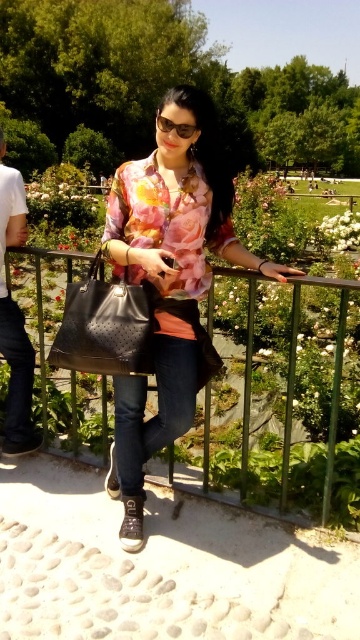
Question: Which of the following is the closest to the observer?

Choices:
 (A) (201, 195)
 (B) (65, 262)
 (C) (16, 188)

Answer: (A)

Question: Is green metal fence at center to the right of white cotton shirt at left from the viewer's perspective?

Choices:
 (A) no
 (B) yes

Answer: (B)

Question: Which of the following is the closest to the observer?

Choices:
 (A) green metal fence at center
 (B) white cotton shirt at left
 (C) floral-patterned shirt at center

Answer: (A)

Question: Which point is closer to the camera?

Choices:
 (A) (9, 321)
 (B) (182, 372)

Answer: (B)

Question: Does floral-patterned shirt at center have a smaller size compared to green metal fence at center?

Choices:
 (A) yes
 (B) no

Answer: (A)

Question: Does green metal fence at center appear on the left side of white cotton shirt at left?

Choices:
 (A) yes
 (B) no

Answer: (B)